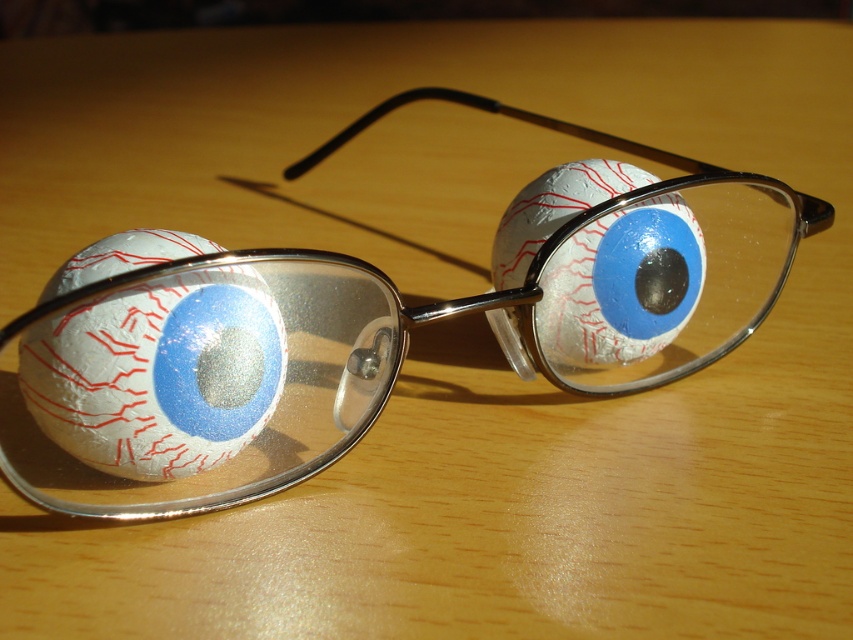
Question: Among these objects, which one is nearest to the camera?

Choices:
 (A) white matte eyeball at center
 (B) matte white eyeball at center

Answer: (A)

Question: Among these objects, which one is nearest to the camera?

Choices:
 (A) matte white eyeball at center
 (B) metallic silver goggles at center
 (C) white matte eyeball at center

Answer: (B)

Question: Does metallic silver goggles at center have a greater width compared to matte white eyeball at center?

Choices:
 (A) yes
 (B) no

Answer: (A)

Question: Is metallic silver goggles at center to the left of matte white eyeball at center from the viewer's perspective?

Choices:
 (A) yes
 (B) no

Answer: (A)

Question: Which of the following is the closest to the observer?

Choices:
 (A) metallic silver goggles at center
 (B) white matte eyeball at center

Answer: (A)

Question: Is metallic silver goggles at center further to the viewer compared to matte white eyeball at center?

Choices:
 (A) yes
 (B) no

Answer: (B)